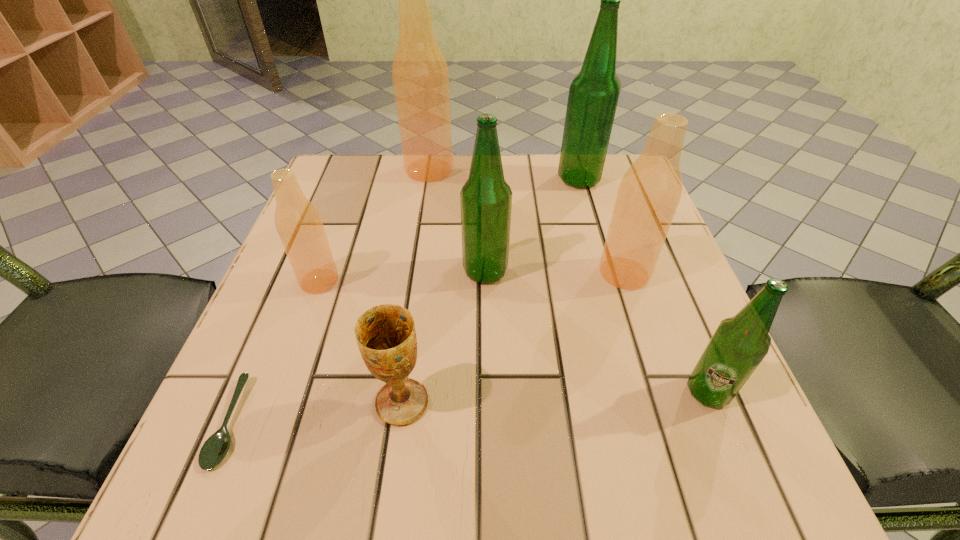
Image resolution: width=960 pixels, height=540 pixels. I want to click on the nearest beer bottle, so click(739, 344).

Locate an element on the screen. Image resolution: width=960 pixels, height=540 pixels. chalice is located at coordinates (386, 336).

Where is `soupspoon`? soupspoon is located at coordinates (216, 447).

The height and width of the screenshot is (540, 960). What are the coordinates of `vacant space positioned 0.350m on the label of the farthest green beer bottle` in the screenshot? It's located at (409, 179).

Locate an element on the screen. vacant area located on the label of the farthest green beer bottle is located at coordinates (472, 179).

This screenshot has height=540, width=960. Identify the location of blank space located on the label of the farthest green beer bottle. (439, 179).

This screenshot has width=960, height=540. What are the coordinates of `free space located 0.330m on the front of the farthest tan beer bottle` in the screenshot? It's located at (412, 285).

Identify the location of free spot located on the label of the third beer bottle from left to right. (307, 271).

The image size is (960, 540). I want to click on vacant region located on the label of the third beer bottle from left to right, so tap(398, 271).

What are the coordinates of `free spot located on the label of the third beer bottle from left to right` in the screenshot? It's located at (372, 271).